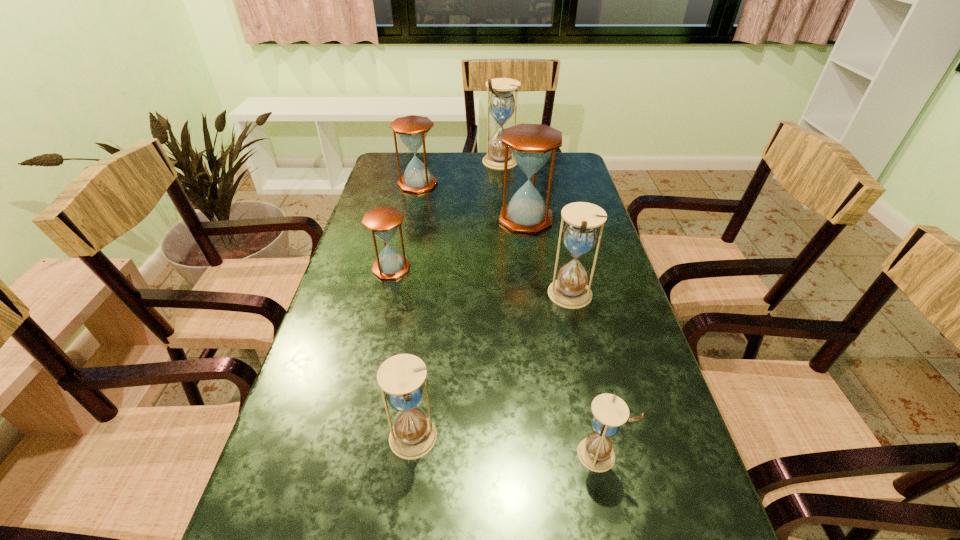
At what (x,y) coordinates should I click in order to perform the action: click on object that can be found as the third closest to the leftmost white hourglass. Please return your answer as a coordinate pair (x, y). Looking at the image, I should click on (383, 221).

The height and width of the screenshot is (540, 960). I want to click on hourglass that is the closest to the tallest hourglass, so click(412, 130).

Locate an element on the screen. hourglass that is the second closest one to the farthest object is located at coordinates (531, 145).

Select which white hourglass is the third closest to the second biggest white hourglass. Please provide its 2D coordinates. Your answer should be formatted as a tuple, i.e. [(x, y)], where the tuple contains the x and y coordinates of a point satisfying the conditions above.

[(502, 104)]

Identify which white hourglass is the third nearest to the nearest brown hourglass. Please provide its 2D coordinates. Your answer should be formatted as a tuple, i.e. [(x, y)], where the tuple contains the x and y coordinates of a point satisfying the conditions above.

[(502, 104)]

Identify which brown hourglass is located as the second nearest to the third farthest hourglass. Please provide its 2D coordinates. Your answer should be formatted as a tuple, i.e. [(x, y)], where the tuple contains the x and y coordinates of a point satisfying the conditions above.

[(383, 221)]

Locate which brown hourglass ranks in proximity to the farthest object. Please provide its 2D coordinates. Your answer should be formatted as a tuple, i.e. [(x, y)], where the tuple contains the x and y coordinates of a point satisfying the conditions above.

[(412, 130)]

Identify the location of free space that satisfies the following two spatial constraints: 1. on the back side of the third farthest object; 2. on the left side of the leftmost white hourglass. The height and width of the screenshot is (540, 960). (440, 218).

The image size is (960, 540). What are the coordinates of `vacant space that satisfies the following two spatial constraints: 1. on the front side of the farthest hourglass; 2. on the left side of the smallest white hourglass` in the screenshot? It's located at (522, 454).